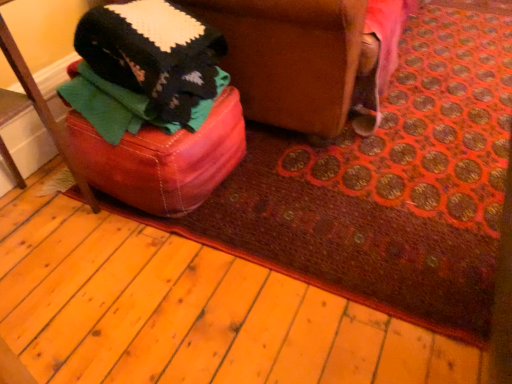
At what (x,y) coordinates should I click in order to perform the action: click on vacant location below leather ottoman at left (from a real-world perspective). Please return your answer as a coordinate pair (x, y). Looking at the image, I should click on (19, 238).